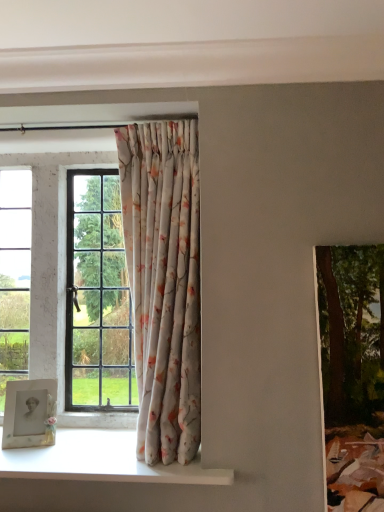
Question: From the image's perspective, is white glossy window sill at lower left located above or below green textured painting at right?

Choices:
 (A) above
 (B) below

Answer: (B)

Question: Looking at their shapes, would you say white glossy window sill at lower left is wider or thinner than green textured painting at right?

Choices:
 (A) wide
 (B) thin

Answer: (A)

Question: Which of these objects is positioned closest to the floral fabric curtain at center?

Choices:
 (A) white glossy window sill at lower left
 (B) green textured painting at right
 (C) matte white picture frame at lower left

Answer: (A)

Question: Estimate the real-world distances between objects in this image. Which object is farther from the matte white picture frame at lower left?

Choices:
 (A) floral fabric curtain at center
 (B) white glossy window sill at lower left
 (C) green textured painting at right

Answer: (C)